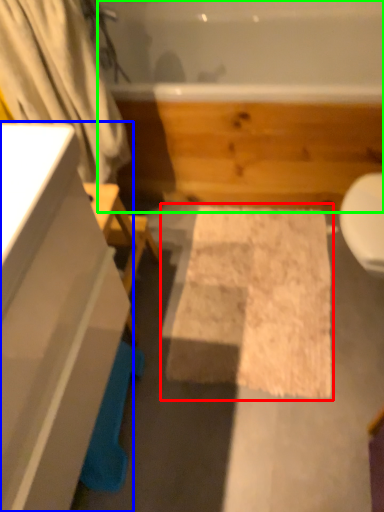
Question: Considering the real-world distances, which object is closest to bath mat (highlighted by a red box)? bathroom cabinet (highlighted by a blue box) or jacuzzi (highlighted by a green box).

Choices:
 (A) bathroom cabinet
 (B) jacuzzi

Answer: (B)